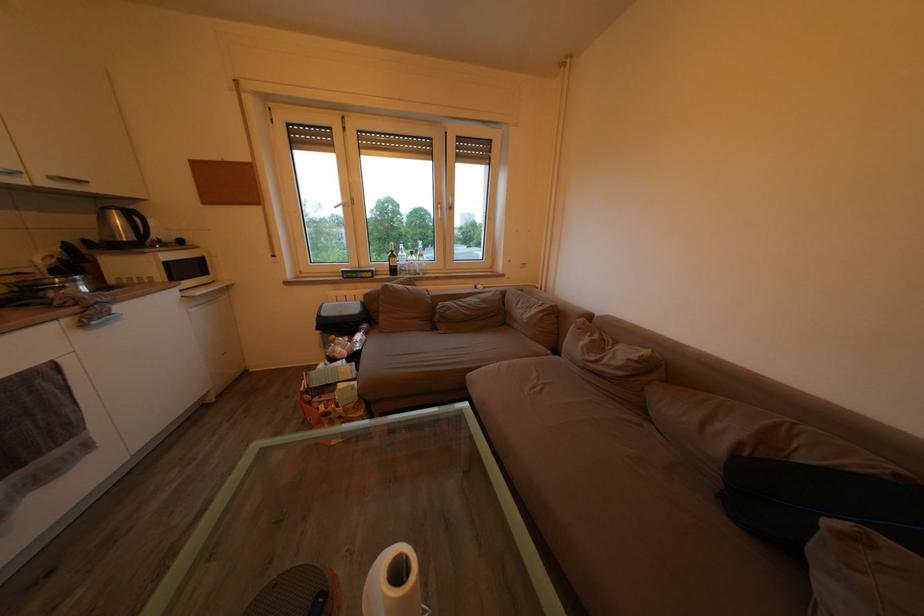
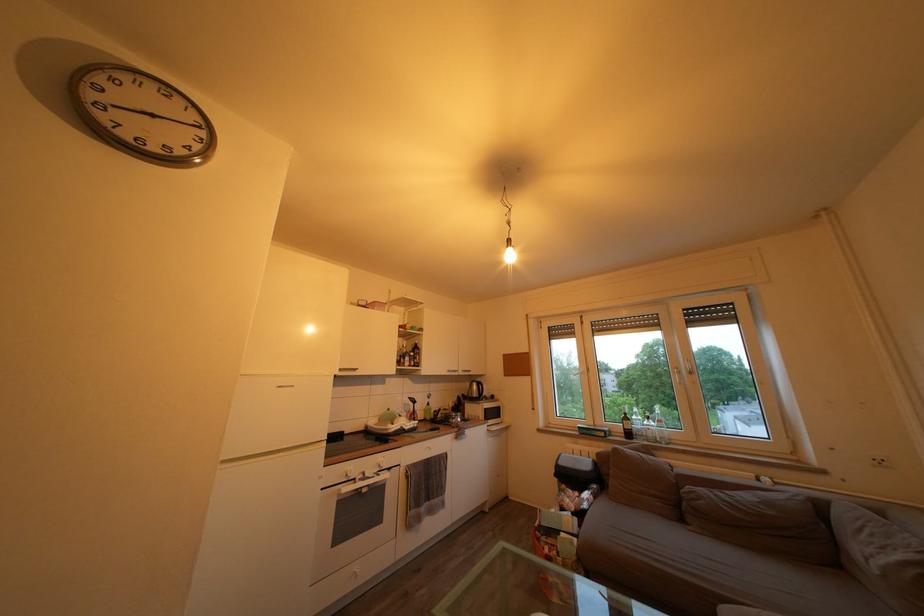
Locate, in the second image, the point that corresponds to the point at 492,307 in the first image.

(774, 509)